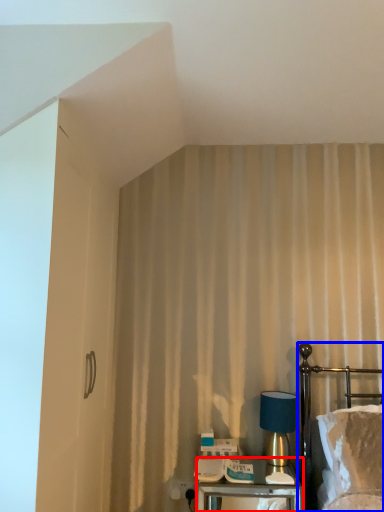
Question: Which object is closer to the camera taking this photo, nightstand (highlighted by a red box) or bed (highlighted by a blue box)?

Choices:
 (A) nightstand
 (B) bed

Answer: (B)